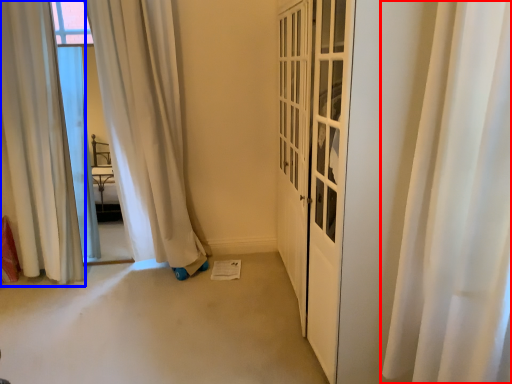
Question: Which point is further to the camera, curtain (highlighted by a red box) or curtain (highlighted by a blue box)?

Choices:
 (A) curtain
 (B) curtain

Answer: (B)